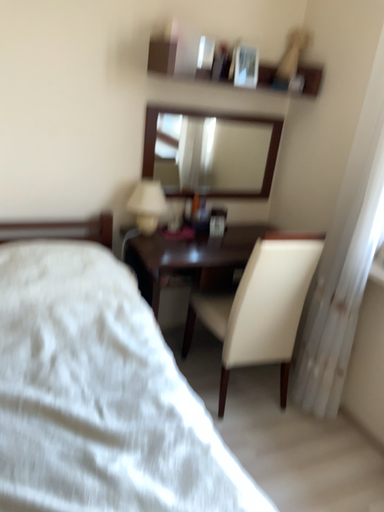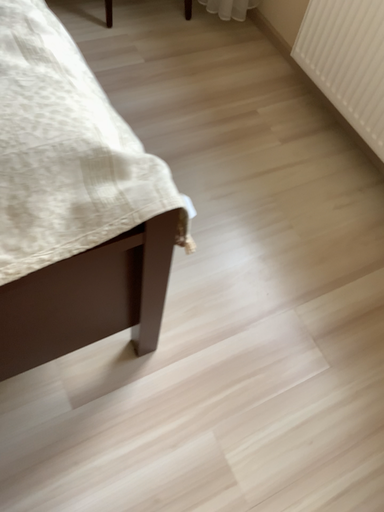
Question: How did the camera likely rotate when shooting the video?

Choices:
 (A) rotated downward
 (B) rotated upward

Answer: (A)